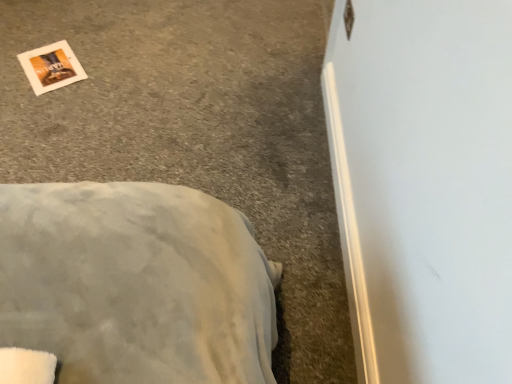
Question: Looking at their shapes, would you say gray carpet at lower left is wider or thinner than white paper at upper left?

Choices:
 (A) thin
 (B) wide

Answer: (B)

Question: From the image's perspective, is gray carpet at lower left positioned above or below white paper at upper left?

Choices:
 (A) below
 (B) above

Answer: (A)

Question: Considering the positions of gray carpet at lower left and white paper at upper left in the image, is gray carpet at lower left bigger or smaller than white paper at upper left?

Choices:
 (A) small
 (B) big

Answer: (B)

Question: In terms of width, does white paper at upper left look wider or thinner when compared to gray carpet at lower left?

Choices:
 (A) wide
 (B) thin

Answer: (B)

Question: From a real-world perspective, is white paper at upper left physically located above or below gray carpet at lower left?

Choices:
 (A) above
 (B) below

Answer: (A)

Question: Is point (44, 69) positioned closer to the camera than point (139, 79)?

Choices:
 (A) closer
 (B) farther

Answer: (B)

Question: Would you say white paper at upper left is to the left or to the right of gray carpet at lower left in the picture?

Choices:
 (A) right
 (B) left

Answer: (B)